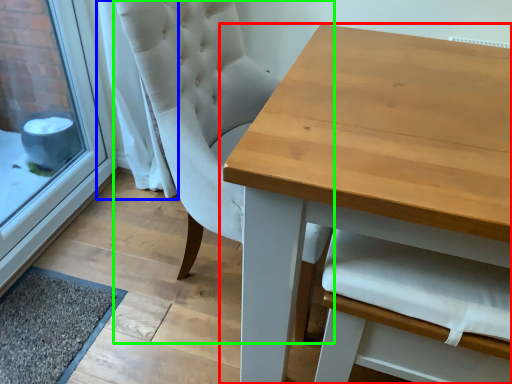
Question: Which object is positioned closest to table (highlighted by a red box)? Select from curtain (highlighted by a blue box) and chair (highlighted by a green box).

Choices:
 (A) curtain
 (B) chair

Answer: (B)